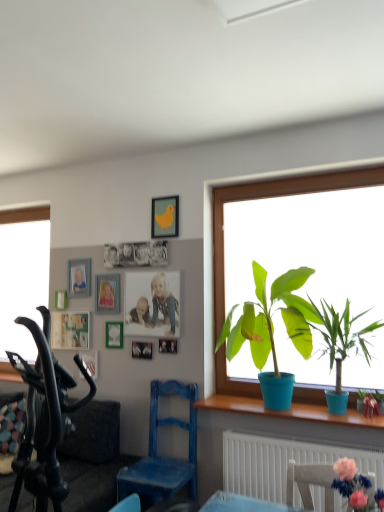
Question: Should I look upward or downward to see matte yellow bird at upper center, which appears as the second picture frame when viewed from the right?

Choices:
 (A) up
 (B) down

Answer: (A)

Question: Can you confirm if matte wooden picture frame at upper center, acting as the second picture frame starting from the left, is thinner than matte yellow bird at upper center, which appears as the second picture frame when viewed from the right?

Choices:
 (A) yes
 (B) no

Answer: (A)

Question: From a real-world perspective, is matte wooden picture frame at upper center, acting as the second picture frame starting from the left, located beneath matte yellow bird at upper center, which appears as the seventh picture frame when viewed from the left?

Choices:
 (A) yes
 (B) no

Answer: (A)

Question: Is matte wooden picture frame at upper center, acting as the second picture frame starting from the left, behind matte yellow bird at upper center, which appears as the second picture frame when viewed from the right?

Choices:
 (A) yes
 (B) no

Answer: (A)

Question: Is matte wooden picture frame at upper center, acting as the second picture frame starting from the left, to the left of matte yellow bird at upper center, which appears as the seventh picture frame when viewed from the left, from the viewer's perspective?

Choices:
 (A) yes
 (B) no

Answer: (A)

Question: Could you tell me if matte wooden picture frame at upper center, arranged as the seventh picture frame when viewed from the right, is turned towards matte yellow bird at upper center, which appears as the seventh picture frame when viewed from the left?

Choices:
 (A) yes
 (B) no

Answer: (B)

Question: Is matte wooden picture frame at upper center, arranged as the seventh picture frame when viewed from the right, taller than matte yellow bird at upper center, which appears as the second picture frame when viewed from the right?

Choices:
 (A) no
 (B) yes

Answer: (A)

Question: Considering the relative sizes of matte wooden picture frame at upper center, arranged as the seventh picture frame when viewed from the right, and blue plastic pot at window, placed as the second houseplant when sorted from right to left, in the image provided, is matte wooden picture frame at upper center, arranged as the seventh picture frame when viewed from the right, taller than blue plastic pot at window, placed as the second houseplant when sorted from right to left,?

Choices:
 (A) yes
 (B) no

Answer: (B)

Question: From the image's perspective, is matte wooden picture frame at upper center, acting as the second picture frame starting from the left, under blue plastic pot at window, placed as the second houseplant when sorted from right to left?

Choices:
 (A) yes
 (B) no

Answer: (B)

Question: Does matte wooden picture frame at upper center, arranged as the seventh picture frame when viewed from the right, appear on the left side of blue plastic pot at window, placed as the second houseplant when sorted from right to left?

Choices:
 (A) no
 (B) yes

Answer: (B)

Question: Is matte wooden picture frame at upper center, arranged as the seventh picture frame when viewed from the right, shorter than blue plastic pot at window, marked as the 2th houseplant in a left-to-right arrangement?

Choices:
 (A) yes
 (B) no

Answer: (A)

Question: Is matte wooden picture frame at upper center, arranged as the seventh picture frame when viewed from the right, positioned with its back to blue plastic pot at window, placed as the second houseplant when sorted from right to left?

Choices:
 (A) yes
 (B) no

Answer: (B)

Question: Are matte wooden picture frame at upper center, arranged as the seventh picture frame when viewed from the right, and blue plastic pot at window, marked as the 2th houseplant in a left-to-right arrangement, making contact?

Choices:
 (A) yes
 (B) no

Answer: (B)

Question: Does green matte plant at window, the 3th houseplant in the right-to-left sequence, have a smaller size compared to matte yellow bird at upper center, which appears as the seventh picture frame when viewed from the left?

Choices:
 (A) no
 (B) yes

Answer: (A)